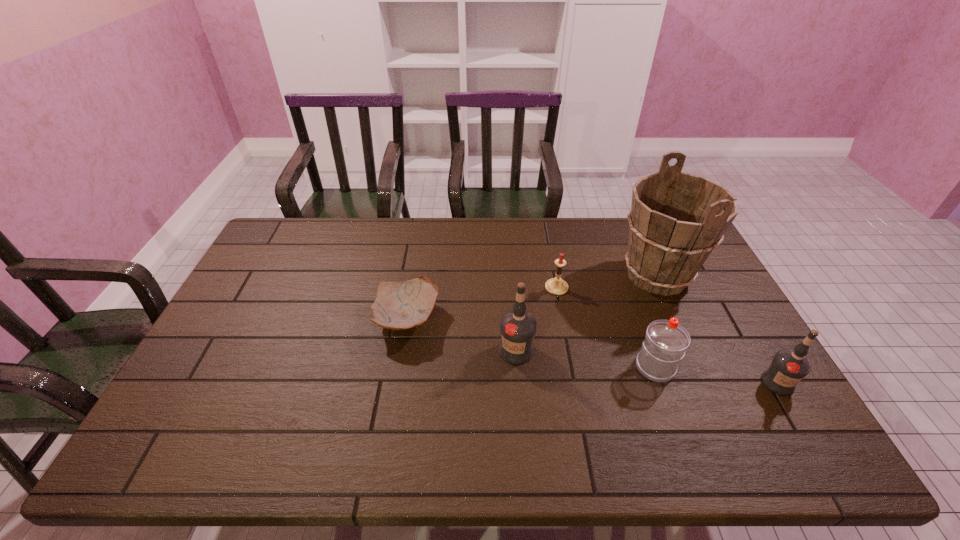
All vodkas are currently evenly spaced. To continue this pattern, where would you add another vodka on the left? Please point out a vacant spot. Please provide its 2D coordinates. Your answer should be formatted as a tuple, i.e. [(x, y)], where the tuple contains the x and y coordinates of a point satisfying the conditions above.

[(286, 322)]